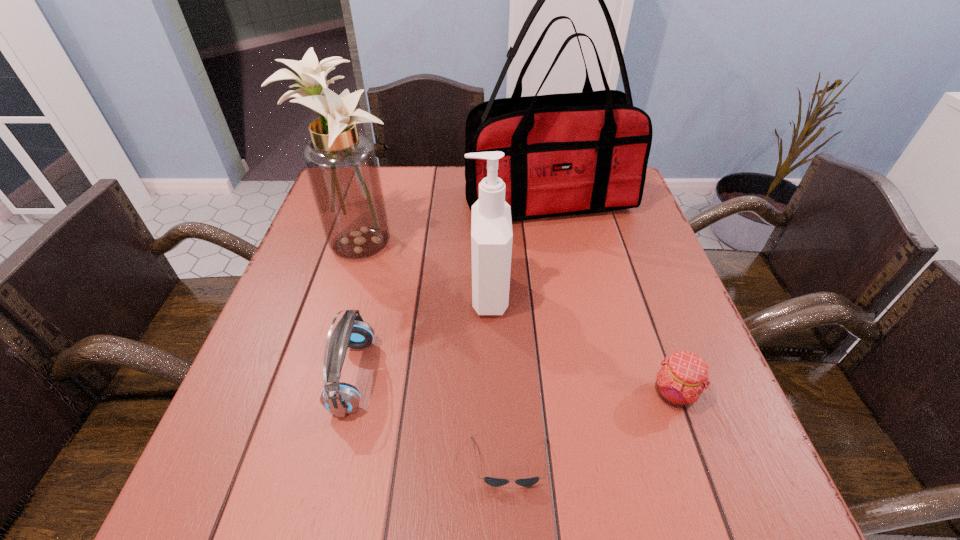
You are a GUI agent. You are given a task and a screenshot of the screen. Output one action in this format:
    pyautogui.click(x=<x>, y=<y>)
    Task: Click on the free space between the duffel bag and the cleansing agent
    The image size is (960, 540).
    Given the screenshot: What is the action you would take?
    coord(518,247)

At what (x,y) coordinates should I click in order to perform the action: click on unoccupied area between the jam and the nearest object. Please return your answer as a coordinate pair (x, y). Looking at the image, I should click on pyautogui.click(x=592, y=428).

Select which object is the fifth closest to the cleansing agent. Please provide its 2D coordinates. Your answer should be formatted as a tuple, i.e. [(x, y)], where the tuple contains the x and y coordinates of a point satisfying the conditions above.

[(683, 376)]

Locate an element on the screen. The width and height of the screenshot is (960, 540). object identified as the fourth closest to the sunglasses is located at coordinates pyautogui.click(x=341, y=164).

Find the location of a particular element. The height and width of the screenshot is (540, 960). vacant space that satisfies the following two spatial constraints: 1. on the ear cups of the third shortest object; 2. on the left side of the jam is located at coordinates tap(348, 394).

Where is `free space that satisfies the following two spatial constraints: 1. on the ear cups of the fifth tallest object; 2. on the left side of the headset`? This screenshot has height=540, width=960. free space that satisfies the following two spatial constraints: 1. on the ear cups of the fifth tallest object; 2. on the left side of the headset is located at coordinates (348, 394).

I want to click on free space in the image that satisfies the following two spatial constraints: 1. on the front label of the jam; 2. on the left side of the cleansing agent, so click(490, 394).